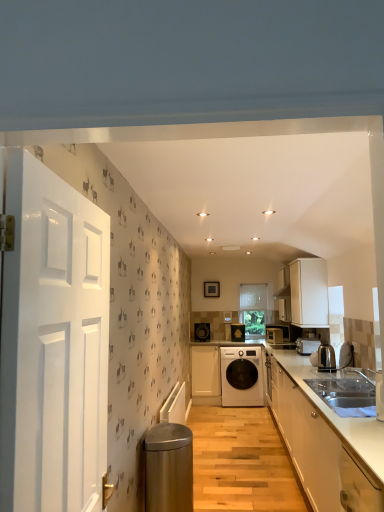
Question: Is white matte cabinet at center, placed as the 1th cabinetry when sorted from left to right, inside white matte cabinet at upper right, the 1th cabinetry when ordered from right to left?

Choices:
 (A) yes
 (B) no

Answer: (B)

Question: Is white matte cabinet at upper right, marked as the 2th cabinetry in a front-to-back arrangement, oriented away from white matte cabinet at center, marked as the third cabinetry in a right-to-left arrangement?

Choices:
 (A) no
 (B) yes

Answer: (A)

Question: Is white matte cabinet at upper right, the 3th cabinetry viewed from the left, shorter than white matte cabinet at center, the first cabinetry positioned from the back?

Choices:
 (A) yes
 (B) no

Answer: (A)

Question: Could you tell me if white matte cabinet at upper right, the 3th cabinetry viewed from the left, is facing white matte cabinet at center, the third cabinetry in the front-to-back sequence?

Choices:
 (A) no
 (B) yes

Answer: (A)

Question: Is the position of white matte cabinet at upper right, arranged as the second cabinetry when viewed from the back, more distant than that of white matte cabinet at center, the third cabinetry in the front-to-back sequence?

Choices:
 (A) no
 (B) yes

Answer: (A)

Question: Is white matte cabinet at upper right, arranged as the second cabinetry when viewed from the back, thinner than white matte cabinet at center, placed as the 1th cabinetry when sorted from left to right?

Choices:
 (A) yes
 (B) no

Answer: (A)

Question: Are metallic silver toaster at lower right, which is the 2th kitchen appliance in back-to-front order, and shiny metallic kettle at right, the first kitchen appliance when ordered from front to back, beside each other?

Choices:
 (A) yes
 (B) no

Answer: (B)

Question: Does metallic silver toaster at lower right, which is the 2th kitchen appliance in back-to-front order, come behind shiny metallic kettle at right, the first kitchen appliance when ordered from front to back?

Choices:
 (A) yes
 (B) no

Answer: (A)

Question: Could shiny metallic kettle at right, the first kitchen appliance when ordered from front to back, be considered to be inside metallic silver toaster at lower right, which is the 2th kitchen appliance in back-to-front order?

Choices:
 (A) yes
 (B) no

Answer: (B)

Question: From the image's perspective, is metallic silver toaster at lower right, which is the 2th kitchen appliance in back-to-front order, on top of shiny metallic kettle at right, the 3th kitchen appliance from the back?

Choices:
 (A) yes
 (B) no

Answer: (B)

Question: Does metallic silver toaster at lower right, which is the second kitchen appliance from front to back, appear on the right side of shiny metallic kettle at right, the 3th kitchen appliance from the back?

Choices:
 (A) yes
 (B) no

Answer: (A)

Question: Considering the relative sizes of metallic silver toaster at lower right, which is the second kitchen appliance from front to back, and shiny metallic kettle at right, the first kitchen appliance when ordered from front to back, in the image provided, is metallic silver toaster at lower right, which is the second kitchen appliance from front to back, taller than shiny metallic kettle at right, the first kitchen appliance when ordered from front to back,?

Choices:
 (A) yes
 (B) no

Answer: (B)

Question: Is white glossy cabinets at lower right, acting as the second cabinetry starting from the left, facing towards white glossy washing machine at center?

Choices:
 (A) yes
 (B) no

Answer: (B)